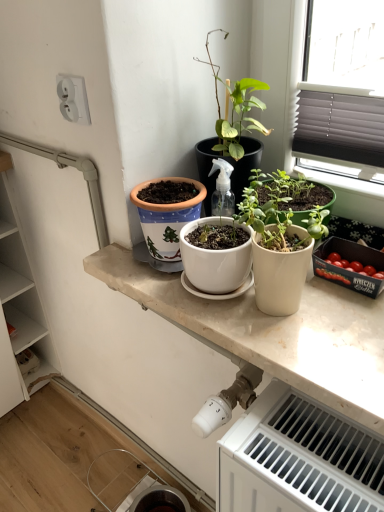
Question: Does white glossy countertop at center appear on the right side of white plastic radiator at lower right?

Choices:
 (A) yes
 (B) no

Answer: (B)

Question: Does white glossy countertop at center have a smaller size compared to white plastic radiator at lower right?

Choices:
 (A) yes
 (B) no

Answer: (A)

Question: Considering the relative sizes of white glossy countertop at center and white plastic radiator at lower right in the image provided, is white glossy countertop at center wider than white plastic radiator at lower right?

Choices:
 (A) yes
 (B) no

Answer: (A)

Question: Considering the relative sizes of white glossy countertop at center and white plastic radiator at lower right in the image provided, is white glossy countertop at center taller than white plastic radiator at lower right?

Choices:
 (A) no
 (B) yes

Answer: (A)

Question: Would you say white glossy countertop at center is a long distance from white plastic radiator at lower right?

Choices:
 (A) no
 (B) yes

Answer: (A)

Question: Is white plastic socket at upper left taller or shorter than green matte plant at center?

Choices:
 (A) tall
 (B) short

Answer: (B)

Question: Relative to green matte plant at center, is white plastic socket at upper left in front or behind?

Choices:
 (A) front
 (B) behind

Answer: (B)

Question: Based on their sizes in the image, would you say white plastic socket at upper left is bigger or smaller than green matte plant at center?

Choices:
 (A) big
 (B) small

Answer: (B)

Question: Would you say white plastic socket at upper left is inside or outside green matte plant at center?

Choices:
 (A) inside
 (B) outside

Answer: (B)

Question: From a real-world perspective, is green matte plant at center positioned above or below white glossy countertop at center?

Choices:
 (A) above
 (B) below

Answer: (A)

Question: In the image, is green matte plant at center positioned in front of or behind white glossy countertop at center?

Choices:
 (A) behind
 (B) front

Answer: (A)

Question: Does point click(x=304, y=140) appear closer or farther from the camera than point click(x=365, y=377)?

Choices:
 (A) closer
 (B) farther

Answer: (B)

Question: Looking at the image, does green matte plant at center seem bigger or smaller compared to white glossy countertop at center?

Choices:
 (A) small
 (B) big

Answer: (B)

Question: Considering the relative positions of white matte pot at center and white glossy countertop at center in the image provided, is white matte pot at center to the left or to the right of white glossy countertop at center?

Choices:
 (A) right
 (B) left

Answer: (A)

Question: Is white matte pot at center taller or shorter than white glossy countertop at center?

Choices:
 (A) tall
 (B) short

Answer: (A)